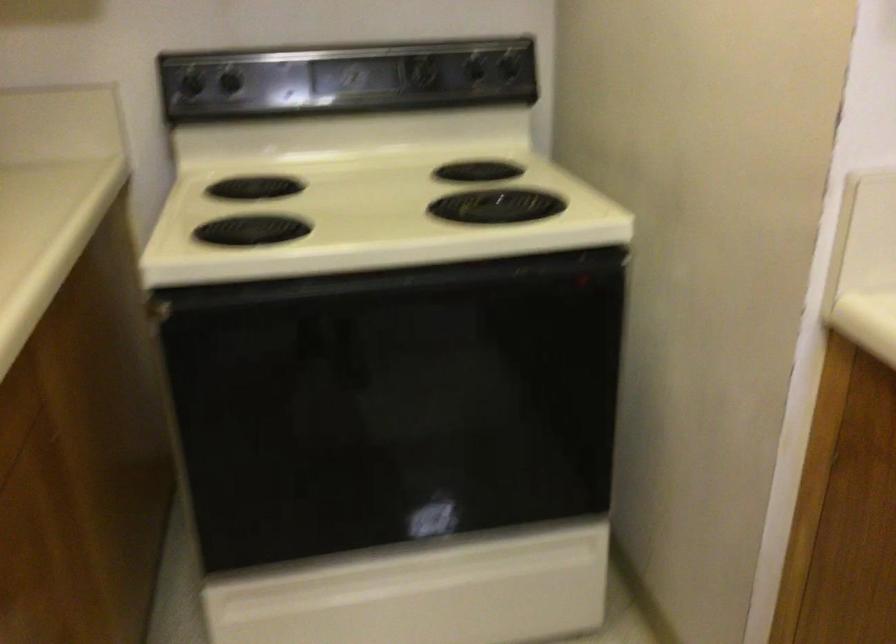
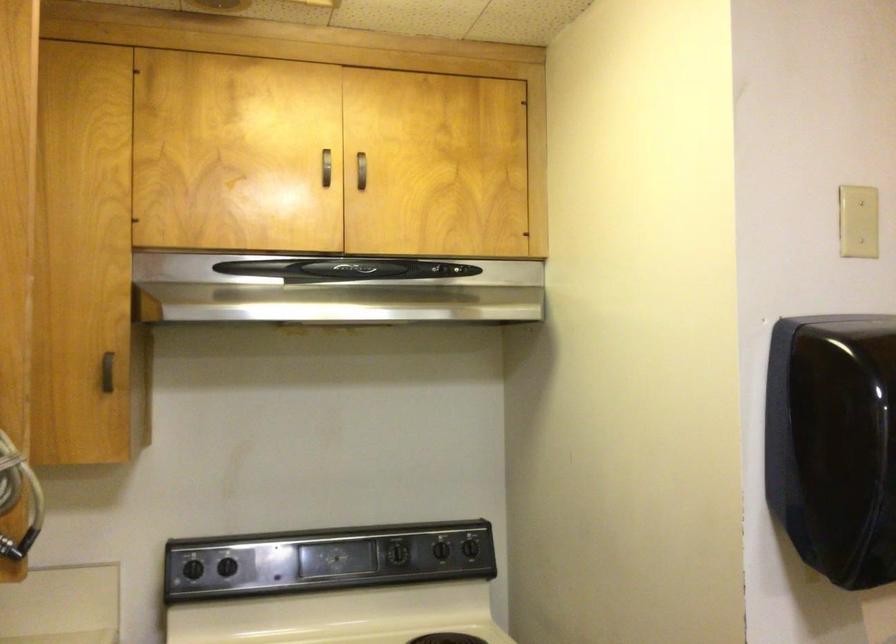
The point at (504,67) is marked in the first image. Where is the corresponding point in the second image?

(470, 547)